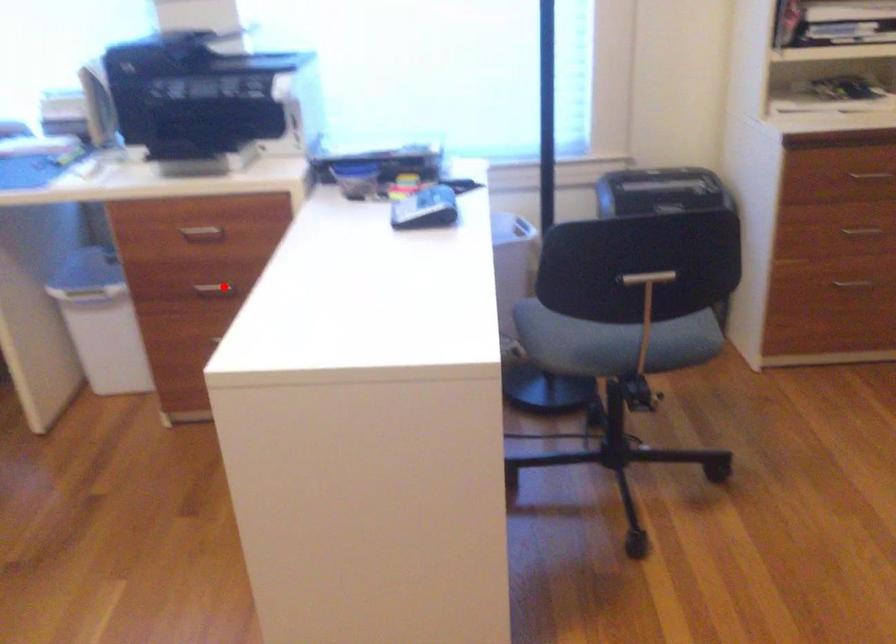
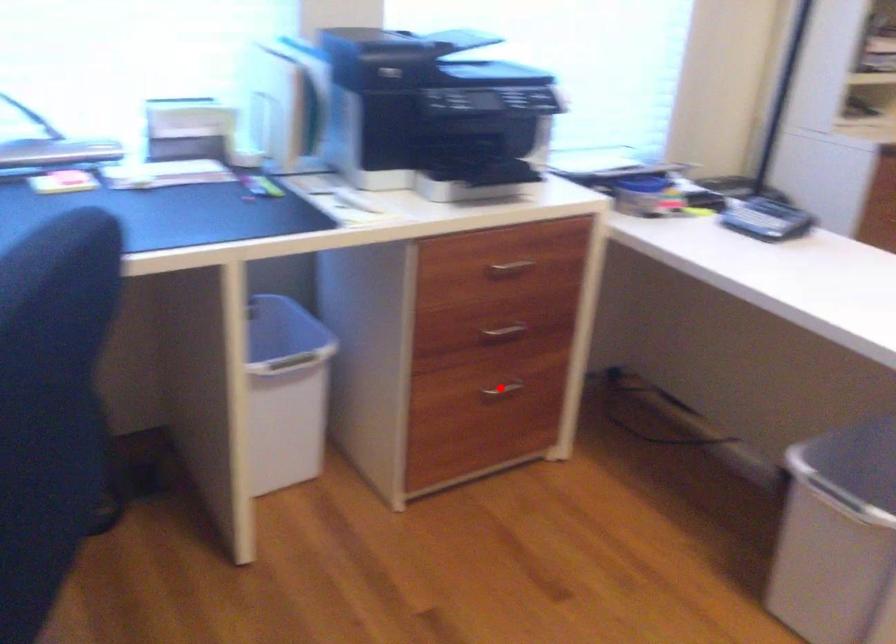
I am providing you with two images of the same scene from different viewpoints. A red point is marked on the first image and another point is marked on the second image. Are the points marked in image1 and image2 representing the same 3D position?

No